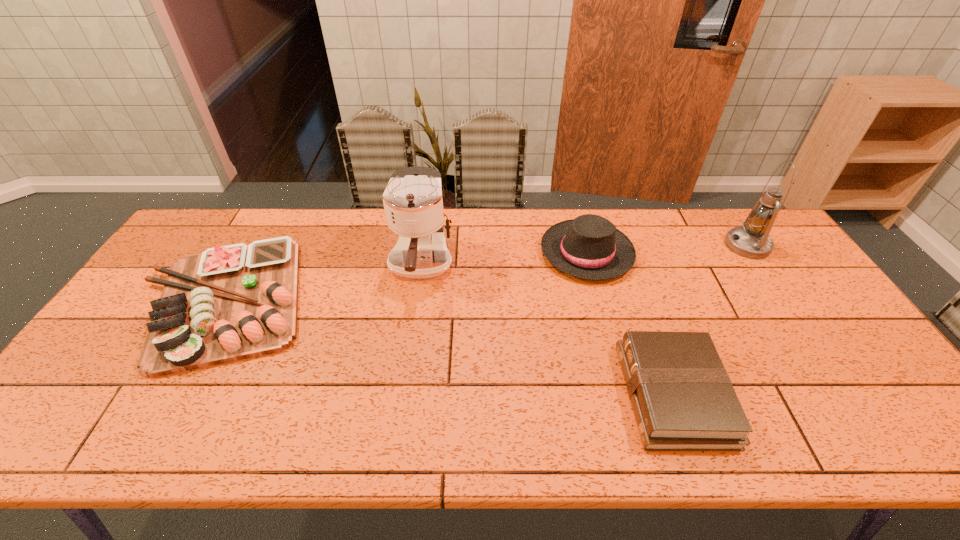
Locate an element on the screen. This screenshot has height=540, width=960. vacant space located 0.220m on the spine side of the Bible is located at coordinates (534, 394).

This screenshot has width=960, height=540. In order to click on free space located on the spine side of the Bible in this screenshot , I will do `click(555, 394)`.

Image resolution: width=960 pixels, height=540 pixels. I want to click on oil lamp present at the far edge, so click(751, 240).

Locate an element on the screen. The height and width of the screenshot is (540, 960). coffee maker that is at the far edge is located at coordinates point(413,203).

I want to click on dress hat located at the far edge, so coord(589,247).

Where is `platter present at the far edge`? Image resolution: width=960 pixels, height=540 pixels. platter present at the far edge is located at coordinates (228, 303).

In order to click on object that is positioned at the near edge in this screenshot , I will do `click(683, 399)`.

Identify the location of object situated at the left edge. The image size is (960, 540). (228, 303).

Identify the location of object that is at the right edge. Image resolution: width=960 pixels, height=540 pixels. (751, 240).

The width and height of the screenshot is (960, 540). What are the coordinates of `object at the far left corner` in the screenshot? It's located at (228, 303).